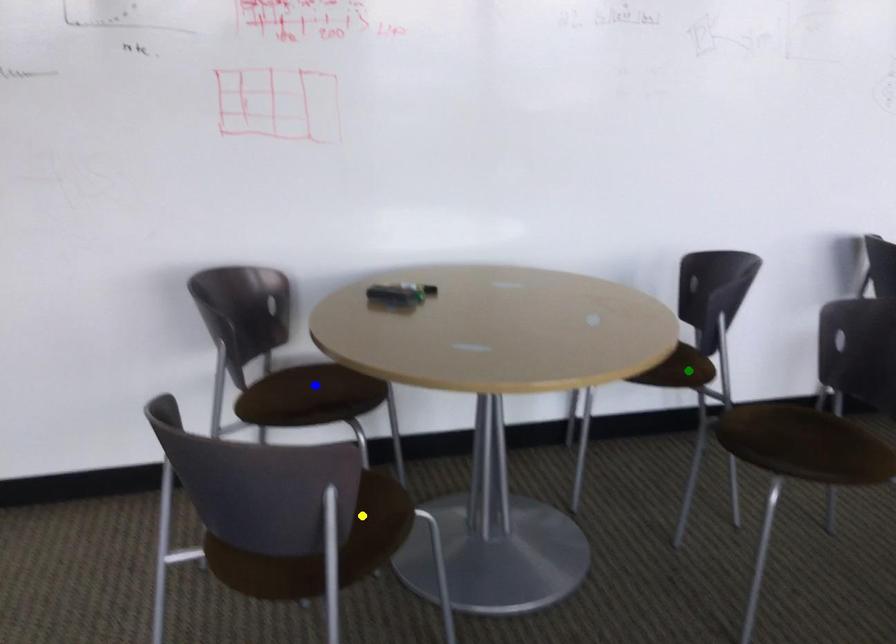
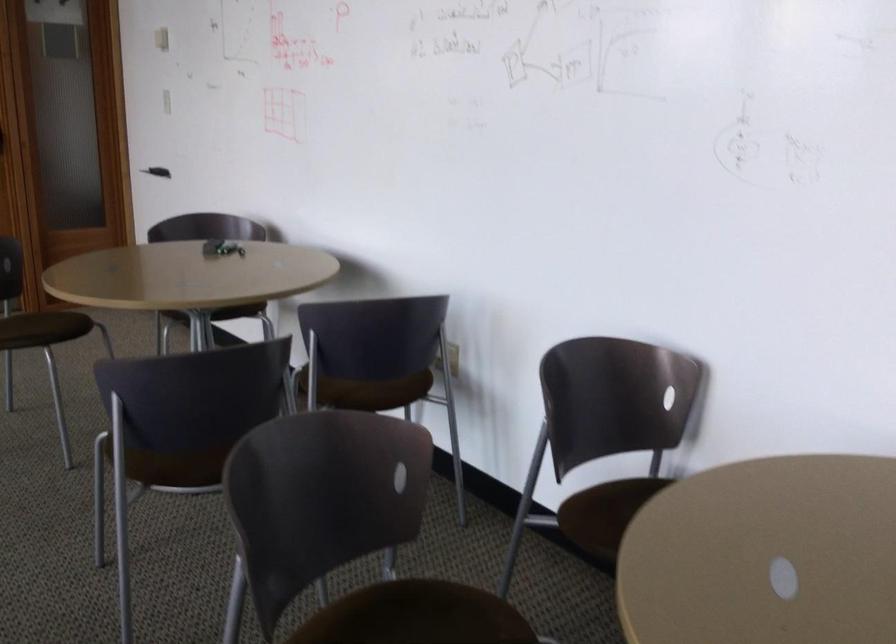
I am providing you with two images of the same scene from different viewpoints. Three points are marked in image1. Which point corresponds to a part or object that is occluded in image2?In image1, three points are marked. Which of them correspond to a part or object that is occluded in image2?Among the three points shown in image1, which one corresponds to a part or object that is no longer visible due to occlusion in image2?

blue point cannot be seen in image2.